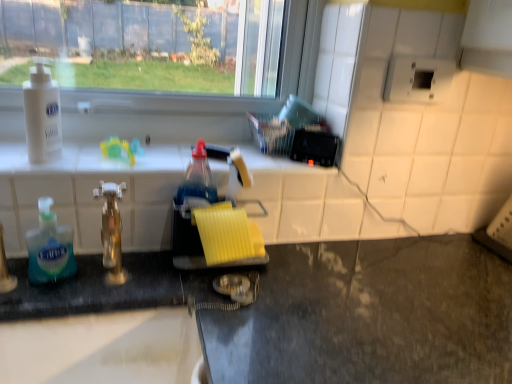
Locate an element on the screen. The height and width of the screenshot is (384, 512). vacant area in front of translucent plastic soap dispenser at left, the 2th bottle positioned from the top is located at coordinates (38, 298).